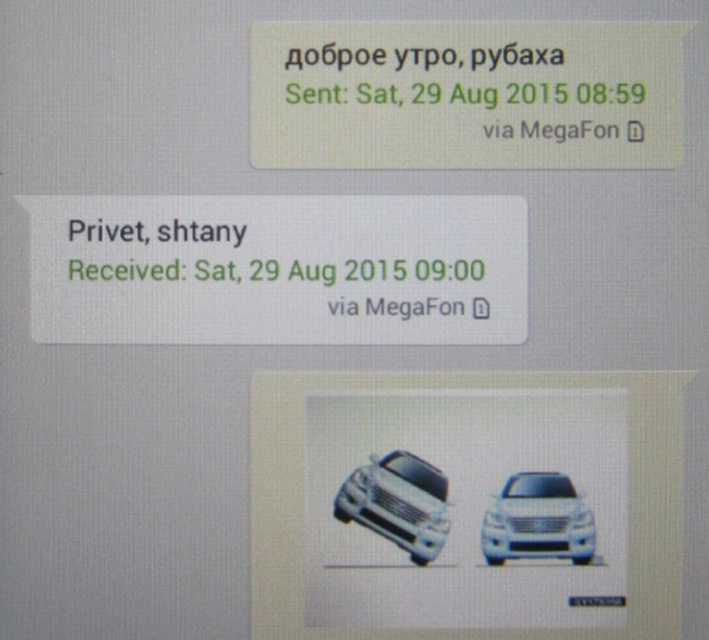
Question: Can you confirm if green matte text message at upper center is positioned to the left of white glossy car at center?

Choices:
 (A) no
 (B) yes

Answer: (B)

Question: Does white paper at center appear on the left side of white glossy car at center?

Choices:
 (A) no
 (B) yes

Answer: (B)

Question: Does white paper at center have a greater width compared to white glossy suv at center?

Choices:
 (A) yes
 (B) no

Answer: (A)

Question: Among these points, which one is farthest from the camera?

Choices:
 (A) (428, 273)
 (B) (432, 492)
 (C) (294, 61)

Answer: (B)

Question: Among these objects, which one is farthest from the camera?

Choices:
 (A) white paper at center
 (B) white glossy car at center

Answer: (B)

Question: Which point appears farthest from the camera in this image?

Choices:
 (A) (530, 65)
 (B) (425, 484)
 (C) (485, 547)
 (D) (267, 308)

Answer: (B)